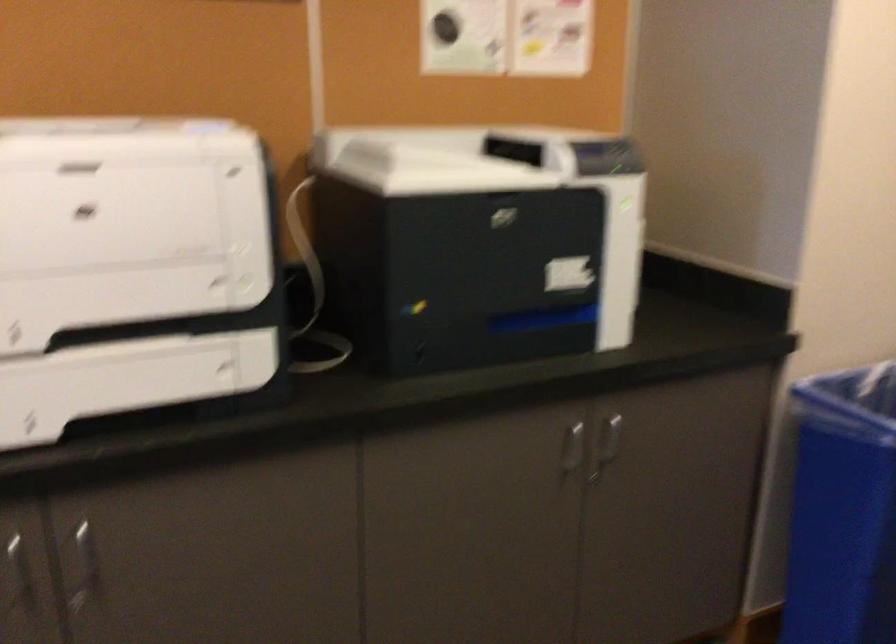
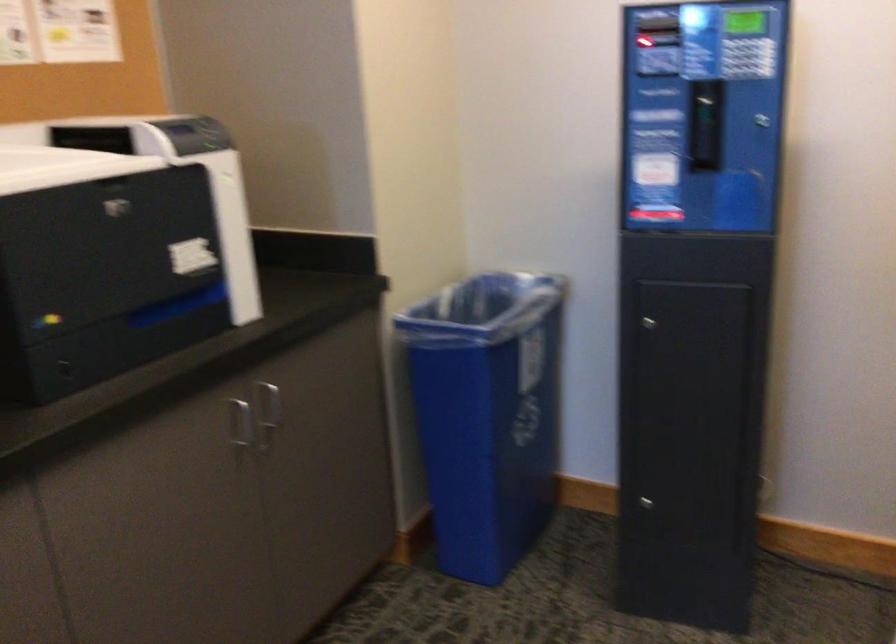
The point at (606, 446) is marked in the first image. Where is the corresponding point in the second image?

(270, 411)